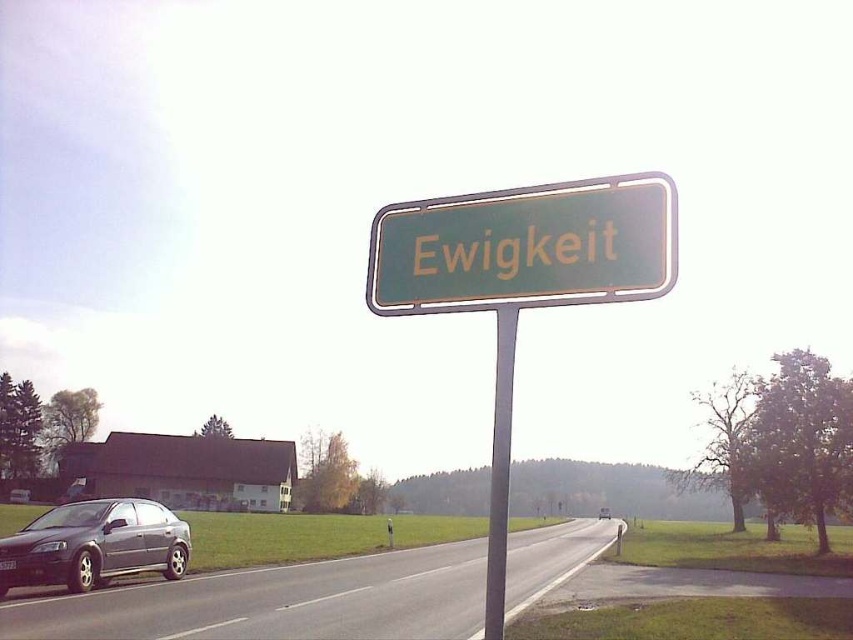
Which is more to the left, metallic gray sedan at lower left or metallic gray pole at center?

metallic gray sedan at lower left is more to the left.

Who is higher up, metallic gray sedan at lower left or metallic gray pole at center?

Positioned higher is metallic gray pole at center.

Is point (21, 556) closer to camera compared to point (496, 616)?

No.

At what (x,y) coordinates should I click in order to perform the action: click on metallic gray sedan at lower left. Please return your answer as a coordinate pair (x, y). This screenshot has width=853, height=640. Looking at the image, I should click on (94, 545).

Is green metallic sign at center above metallic gray pole at center?

Yes, green metallic sign at center is above metallic gray pole at center.

Who is positioned more to the right, green metallic sign at center or metallic gray pole at center?

Positioned to the right is metallic gray pole at center.

Is point (589, 285) more distant than point (498, 540)?

Yes.

Locate an element on the screen. green metallic sign at center is located at coordinates (525, 248).

Who is lower down, green metallic sign at center or metallic gray sedan at lower left?

metallic gray sedan at lower left is lower down.

Does point (442, 291) come in front of point (33, 518)?

Yes, it is in front of point (33, 518).

Who is more forward, (512, 296) or (77, 509)?

Point (512, 296) is in front.

Locate an element on the screen. Image resolution: width=853 pixels, height=640 pixels. green metallic sign at center is located at coordinates (525, 248).